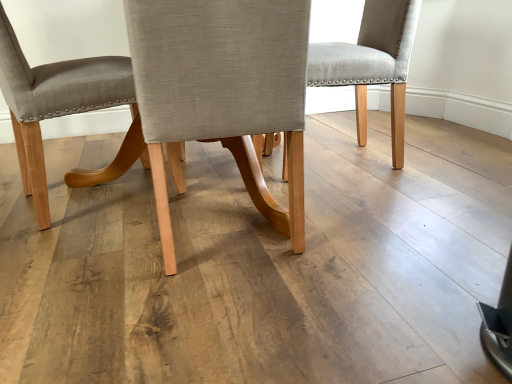
Question: Is light gray fabric chair at center, marked as the 2th chair in a right-to-left arrangement, completely or partially inside light gray fabric chair at center, which is the third chair in left-to-right order?

Choices:
 (A) yes
 (B) no

Answer: (B)

Question: From the image's perspective, is light gray fabric chair at center, the 1th chair when ordered from right to left, above light gray fabric chair at center, which is counted as the second chair, starting from the left?

Choices:
 (A) yes
 (B) no

Answer: (A)

Question: Is light gray fabric chair at center, which is the third chair in left-to-right order, placed right next to light gray fabric chair at center, marked as the 2th chair in a right-to-left arrangement?

Choices:
 (A) no
 (B) yes

Answer: (A)

Question: Is light gray fabric chair at center, which is the third chair in left-to-right order, positioned behind light gray fabric chair at center, which is counted as the second chair, starting from the left?

Choices:
 (A) yes
 (B) no

Answer: (A)

Question: Can you confirm if light gray fabric chair at center, the 1th chair when ordered from right to left, is wider than light gray fabric chair at center, which is counted as the second chair, starting from the left?

Choices:
 (A) no
 (B) yes

Answer: (A)

Question: From the image's perspective, relative to light gray fabric chair at center, marked as the 2th chair in a right-to-left arrangement, is matte gray fabric chair at center, placed as the third chair when sorted from right to left, above or below?

Choices:
 (A) below
 (B) above

Answer: (B)

Question: Considering the positions of point (27, 135) and point (151, 114), is point (27, 135) closer or farther from the camera than point (151, 114)?

Choices:
 (A) closer
 (B) farther

Answer: (B)

Question: From their relative heights in the image, would you say matte gray fabric chair at center, placed as the third chair when sorted from right to left, is taller or shorter than light gray fabric chair at center, marked as the 2th chair in a right-to-left arrangement?

Choices:
 (A) tall
 (B) short

Answer: (A)

Question: Looking at the image, does matte gray fabric chair at center, placed as the third chair when sorted from right to left, seem bigger or smaller compared to light gray fabric chair at center, which is counted as the second chair, starting from the left?

Choices:
 (A) big
 (B) small

Answer: (A)

Question: Relative to light gray fabric chair at center, marked as the 2th chair in a right-to-left arrangement, is light gray fabric chair at center, which is the third chair in left-to-right order, in front or behind?

Choices:
 (A) front
 (B) behind

Answer: (B)

Question: Is light gray fabric chair at center, the 1th chair when ordered from right to left, taller or shorter than light gray fabric chair at center, marked as the 2th chair in a right-to-left arrangement?

Choices:
 (A) short
 (B) tall

Answer: (A)

Question: Does point (266, 137) appear closer or farther from the camera than point (245, 77)?

Choices:
 (A) farther
 (B) closer

Answer: (A)

Question: Is light gray fabric chair at center, which is the third chair in left-to-right order, situated inside light gray fabric chair at center, marked as the 2th chair in a right-to-left arrangement, or outside?

Choices:
 (A) outside
 (B) inside

Answer: (A)

Question: From their relative heights in the image, would you say light gray fabric chair at center, the 1th chair when ordered from right to left, is taller or shorter than matte gray fabric chair at center, which appears as the first chair when viewed from the left?

Choices:
 (A) tall
 (B) short

Answer: (B)

Question: Which is correct: light gray fabric chair at center, the 1th chair when ordered from right to left, is inside matte gray fabric chair at center, placed as the third chair when sorted from right to left, or outside of it?

Choices:
 (A) outside
 (B) inside

Answer: (A)